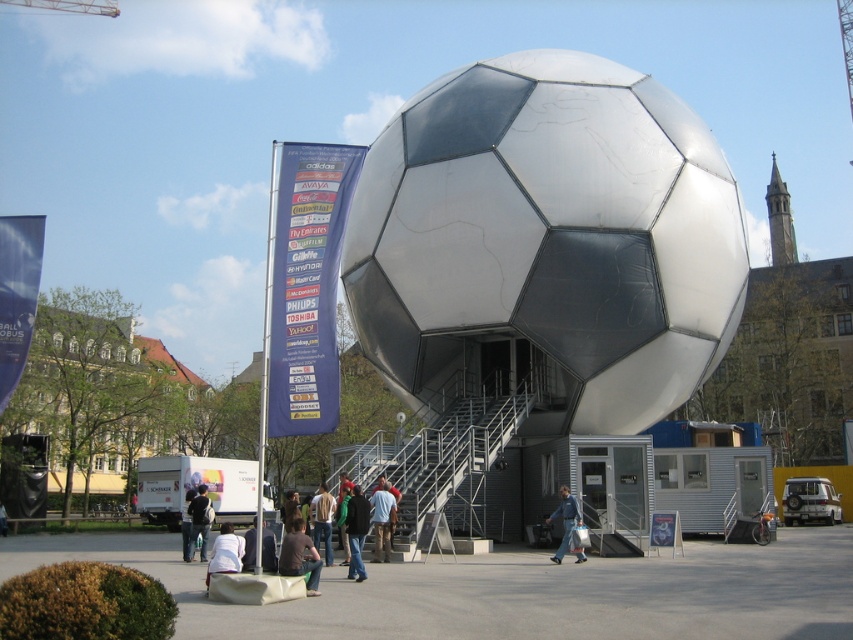
You are standing at the entrance of the small gray building attached to the large spherical structure. You want to place a new bench exactly at the 2D coordinate point mentioned for the denim jacket at lower center. What are the coordinates where you should place the bench?

The coordinates for the denim jacket at lower center are at point (566, 520), so the bench should be placed at those coordinates.

You are a security guard at the plaza and need to place a denim jacket at lower center and a dark blue backpack at center in a storage locker. The locker has a width of 30 cm. Which item can fit inside the locker based on their widths?

The denim jacket at lower center has a lesser width compared to the dark blue backpack at center. Since the locker is 30 cm wide, the denim jacket at lower center can fit inside the locker, but the dark blue backpack at center may be too wide to fit.

You are standing at the entrance of the sphere structure and see the point marked at coordinates (566, 520). What object is located at that point?

The point at coordinates (566, 520) corresponds to the denim jacket at lower center.